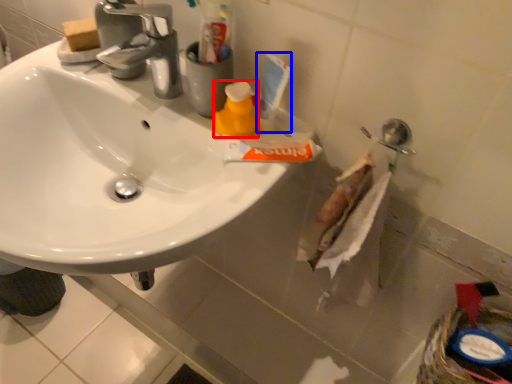
Question: Which point is further to the camera, cleaning product (highlighted by a red box) or toiletry (highlighted by a blue box)?

Choices:
 (A) cleaning product
 (B) toiletry

Answer: (A)